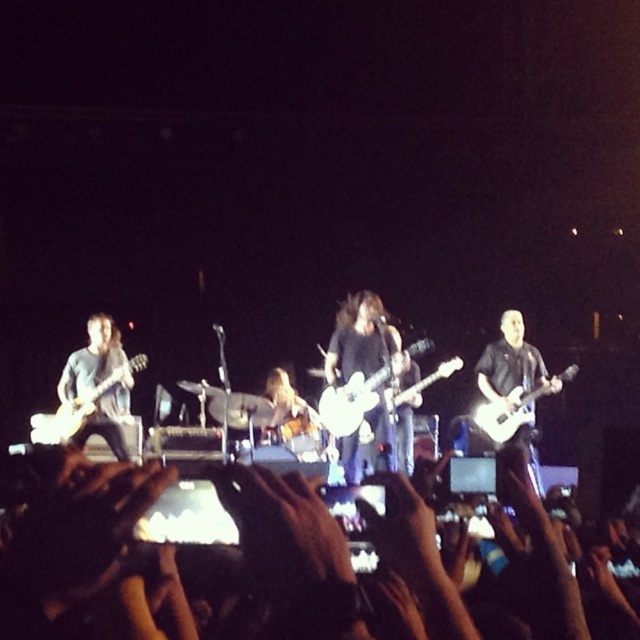
Measure the distance from white glossy electric guitar at right to matte black guitar at center.

They are 7.17 feet apart.

Is point (497, 435) less distant than point (275, 392)?

That is True.

Find the location of a particular element. This screenshot has height=640, width=640. white glossy electric guitar at right is located at coordinates (513, 410).

Does point (433, 545) lie in front of point (90, 369)?

That is True.

Does dark skin hands at lower center appear under matte black guitar at left?

Actually, dark skin hands at lower center is above matte black guitar at left.

Who is more forward, (307, 580) or (116, 412)?

Point (307, 580)

Where is `dark skin hands at lower center`? This screenshot has width=640, height=640. dark skin hands at lower center is located at coordinates (333, 563).

Is white glossy electric guitar at right thinner than white matte electric guitar at left?

Indeed, white glossy electric guitar at right has a lesser width compared to white matte electric guitar at left.

Which is in front, point (557, 378) or point (116, 380)?

Point (116, 380) is in front.

What do you see at coordinates (513, 410) in the screenshot?
I see `white glossy electric guitar at right` at bounding box center [513, 410].

Where is `white glossy electric guitar at right`? This screenshot has height=640, width=640. white glossy electric guitar at right is located at coordinates (513, 410).